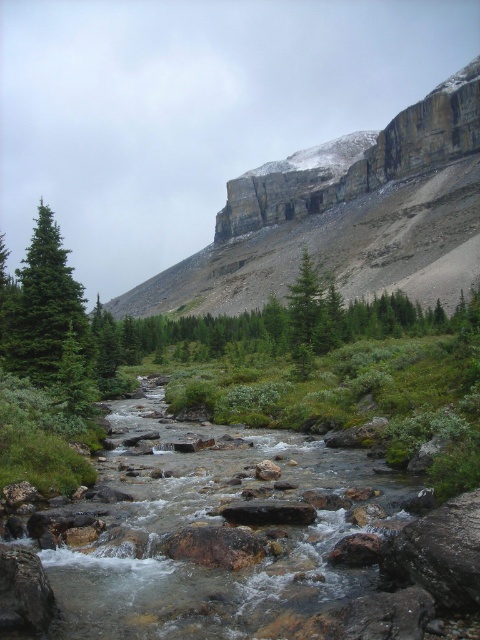
In the serene landscape with the flowing stream, you notice a gray rocky cliff at upper right and a green matte evergreen tree at center. Which object occupies a larger area in the scene?

The gray rocky cliff at upper right is bigger than the green matte evergreen tree at center, so it occupies a larger area in the scene.

You are standing at the point labeled point (33, 364). You want to cross the stream to reach the other side. The stream is flowing rapidly. What is the minimum distance you need to walk along the stream to find a safe crossing point where the water is shallow enough to cross?

The minimum distance you need to walk along the stream to find a safe crossing point is 175.79 feet.

You are a hiker who wants to cross the stream safely. The gray rocky cliff at upper right and the green matte evergreen tree at left are landmarks. Which landmark is closer to your current position if you are standing on the opposite side of the stream?

The green matte evergreen tree at left is closer to your current position because the distance between the gray rocky cliff at upper right and the green matte evergreen tree at left is 211.14 meters, so the tree is nearer when standing opposite the stream.